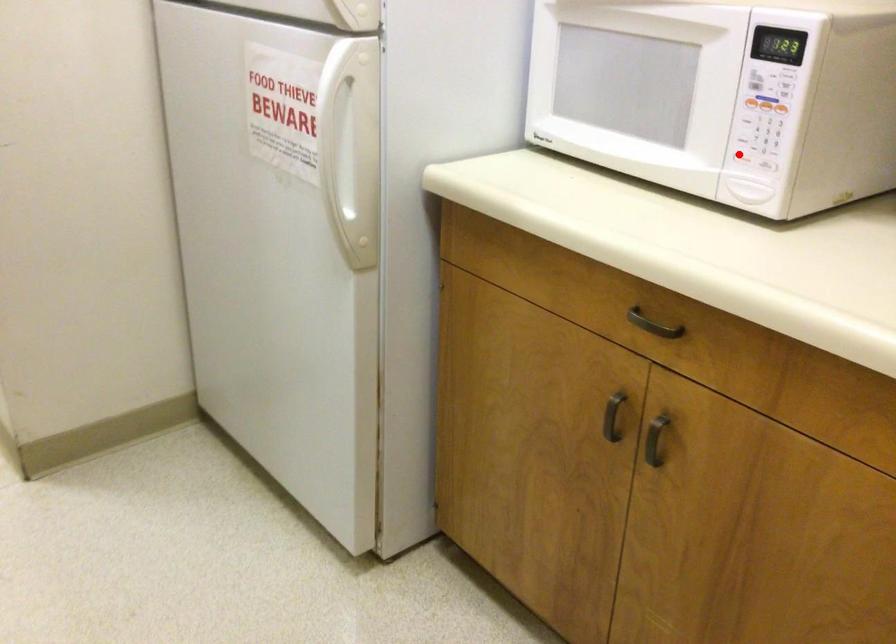
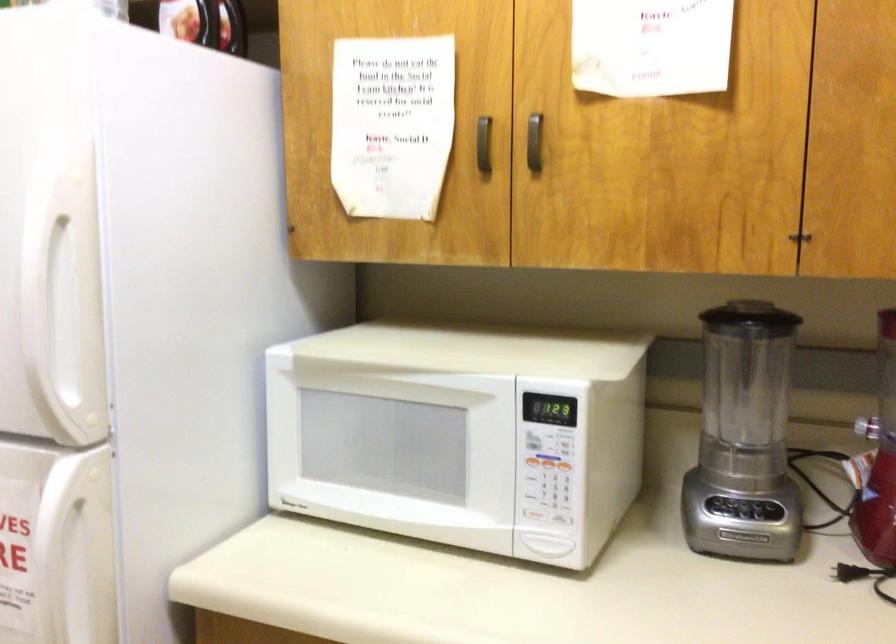
Question: I am providing you with two images of the same scene from different viewpoints. A red point is marked on the first image. Is the red point's position out of view in image 2?

Choices:
 (A) Yes
 (B) No

Answer: (B)